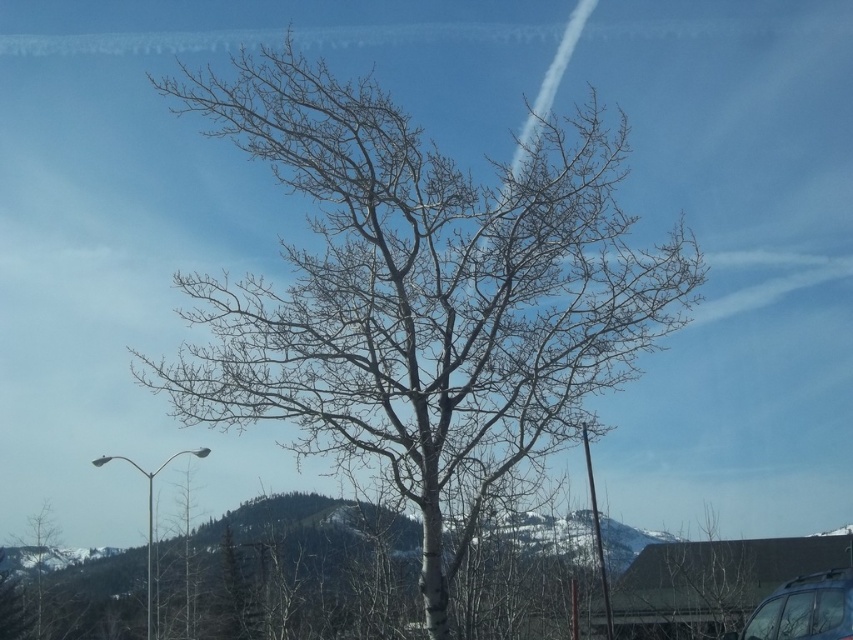
You are a painter standing 10 meters away from a large canvas. You want to paint the scene of the bare wood tree at center. If the tree is 9.25 meters away from you, will you be able to accurately capture its full view on the canvas without moving closer?

The bare wood tree at center is 9.25 meters away from the viewer, which is within the 10 meters distance you are standing from the canvas. This means you can accurately capture its full view on the canvas without needing to move closer.

You are a passenger in a car driving through a scenic route. You notice the bare wood tree at lower left and the transparent glass car window at center. Which object would appear closer to you from your viewpoint inside the car?

The bare wood tree at lower left appears closer because it is larger in size compared to the transparent glass car window at center, indicating it is nearer to the observer.

You are planning to paint a landscape and want to ensure proper perspective. Given the scene with the bare wood tree at center and the bare wood tree at lower left, which tree should you paint first to establish depth?

You should paint the bare wood tree at lower left first because it is smaller and closer to the foreground, allowing you to build depth by placing the larger, central tree behind it.